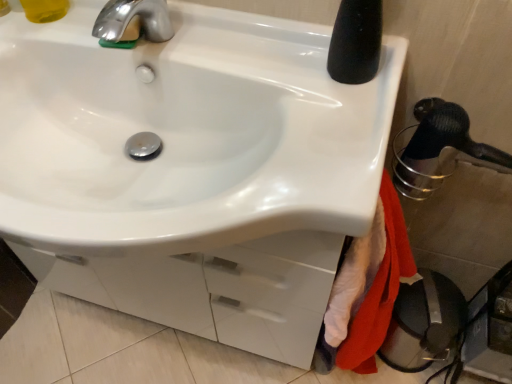
Question: Is red cotton bath towel at lower right to the right of white glossy sink at center from the viewer's perspective?

Choices:
 (A) yes
 (B) no

Answer: (A)

Question: Considering the relative sizes of red cotton bath towel at lower right and white glossy sink at center in the image provided, is red cotton bath towel at lower right shorter than white glossy sink at center?

Choices:
 (A) yes
 (B) no

Answer: (B)

Question: From the image's perspective, does red cotton bath towel at lower right appear higher than white glossy sink at center?

Choices:
 (A) yes
 (B) no

Answer: (B)

Question: From a real-world perspective, does red cotton bath towel at lower right sit lower than white glossy sink at center?

Choices:
 (A) no
 (B) yes

Answer: (B)

Question: Is the depth of red cotton bath towel at lower right less than that of white glossy sink at center?

Choices:
 (A) no
 (B) yes

Answer: (A)

Question: Would you say red cotton bath towel at lower right is inside or outside white glossy sink at center?

Choices:
 (A) inside
 (B) outside

Answer: (B)

Question: Is red cotton bath towel at lower right in front of or behind white glossy sink at center in the image?

Choices:
 (A) front
 (B) behind

Answer: (B)

Question: Considering the positions of red cotton bath towel at lower right and white glossy sink at center in the image, is red cotton bath towel at lower right bigger or smaller than white glossy sink at center?

Choices:
 (A) big
 (B) small

Answer: (B)

Question: Based on their positions, is red cotton bath towel at lower right located to the left or right of white glossy sink at center?

Choices:
 (A) left
 (B) right

Answer: (B)

Question: Is translucent yellow liquid at upper left inside or outside of white glossy sink at center?

Choices:
 (A) inside
 (B) outside

Answer: (B)

Question: In terms of width, does translucent yellow liquid at upper left look wider or thinner when compared to white glossy sink at center?

Choices:
 (A) thin
 (B) wide

Answer: (A)

Question: In terms of height, does translucent yellow liquid at upper left look taller or shorter compared to white glossy sink at center?

Choices:
 (A) short
 (B) tall

Answer: (A)

Question: From a real-world perspective, is translucent yellow liquid at upper left above or below white glossy sink at center?

Choices:
 (A) below
 (B) above

Answer: (B)

Question: From the image's perspective, is red cotton bath towel at lower right located above or below black rubber shower head at right?

Choices:
 (A) below
 (B) above

Answer: (A)

Question: Does point (349, 354) appear closer or farther from the camera than point (403, 152)?

Choices:
 (A) farther
 (B) closer

Answer: (A)